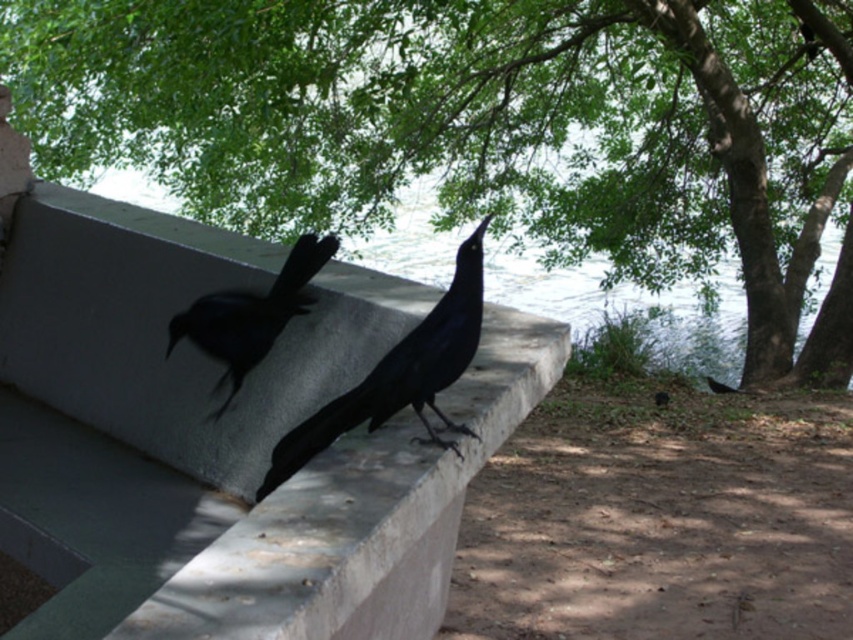
Does smooth concrete ledge at center have a lesser width compared to shiny black bird at center?

In fact, smooth concrete ledge at center might be wider than shiny black bird at center.

This screenshot has height=640, width=853. What do you see at coordinates (225, 438) in the screenshot? I see `smooth concrete ledge at center` at bounding box center [225, 438].

Between point (321, 632) and point (346, 403), which one is positioned in front?

Point (321, 632) is more forward.

At what (x,y) coordinates should I click in order to perform the action: click on smooth concrete ledge at center. Please return your answer as a coordinate pair (x, y). The image size is (853, 640). Looking at the image, I should click on (225, 438).

Who is shorter, green leafy tree at upper center or smooth concrete ledge at center?

smooth concrete ledge at center is shorter.

Can you confirm if green leafy tree at upper center is positioned to the left of smooth concrete ledge at center?

Incorrect, green leafy tree at upper center is not on the left side of smooth concrete ledge at center.

Between point (96, 49) and point (519, 365), which one is positioned behind?

Positioned behind is point (96, 49).

Image resolution: width=853 pixels, height=640 pixels. Find the location of `green leafy tree at upper center`. green leafy tree at upper center is located at coordinates (480, 125).

Who is more distant from viewer, (418, 477) or (273, 282)?

The point (273, 282) is behind.

This screenshot has height=640, width=853. What are the coordinates of `smooth concrete ledge at center` in the screenshot? It's located at (225, 438).

The width and height of the screenshot is (853, 640). In order to click on smooth concrete ledge at center in this screenshot , I will do tap(225, 438).